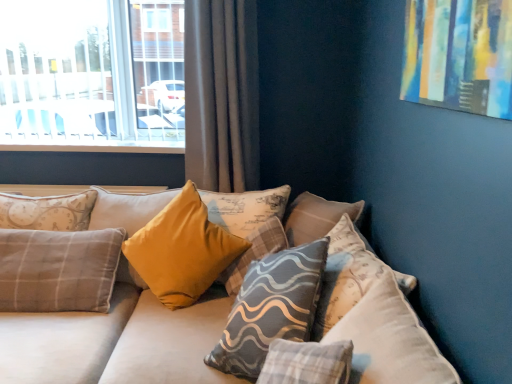
Question: Does clear glass window at upper left appear on the left side of velvet beige couch at center?

Choices:
 (A) no
 (B) yes

Answer: (B)

Question: Is clear glass window at upper left further to camera compared to velvet beige couch at center?

Choices:
 (A) no
 (B) yes

Answer: (B)

Question: Does clear glass window at upper left have a lesser width compared to velvet beige couch at center?

Choices:
 (A) no
 (B) yes

Answer: (B)

Question: Is clear glass window at upper left outside of velvet beige couch at center?

Choices:
 (A) no
 (B) yes

Answer: (B)

Question: Is clear glass window at upper left facing towards velvet beige couch at center?

Choices:
 (A) no
 (B) yes

Answer: (A)

Question: From a real-world perspective, is clear glass window at upper left physically below velvet beige couch at center?

Choices:
 (A) no
 (B) yes

Answer: (A)

Question: Does gray textured pillow at center, marked as the 2th pillow in a left-to-right arrangement, have a lesser width compared to yellow fabric pillow at center, placed as the 1th pillow when sorted from left to right?

Choices:
 (A) yes
 (B) no

Answer: (B)

Question: Considering the relative positions of gray textured pillow at center, marked as the 2th pillow in a left-to-right arrangement, and yellow fabric pillow at center, placed as the 1th pillow when sorted from left to right, in the image provided, is gray textured pillow at center, marked as the 2th pillow in a left-to-right arrangement, behind yellow fabric pillow at center, placed as the 1th pillow when sorted from left to right,?

Choices:
 (A) no
 (B) yes

Answer: (A)

Question: Is gray textured pillow at center, the third pillow positioned from the right, completely or partially outside of yellow fabric pillow at center, the 4th pillow viewed from the right?

Choices:
 (A) no
 (B) yes

Answer: (B)

Question: Is gray textured pillow at center, marked as the 2th pillow in a left-to-right arrangement, in front of yellow fabric pillow at center, the 4th pillow viewed from the right?

Choices:
 (A) no
 (B) yes

Answer: (B)

Question: Is gray textured pillow at center, the third pillow positioned from the right, to the left of yellow fabric pillow at center, placed as the 1th pillow when sorted from left to right, from the viewer's perspective?

Choices:
 (A) no
 (B) yes

Answer: (A)

Question: Does gray textured pillow at center, the third pillow positioned from the right, have a smaller size compared to yellow fabric pillow at center, placed as the 1th pillow when sorted from left to right?

Choices:
 (A) yes
 (B) no

Answer: (A)

Question: Does clear glass window at upper left appear on the right side of gray textured pillow at center, the third pillow positioned from the right?

Choices:
 (A) no
 (B) yes

Answer: (A)